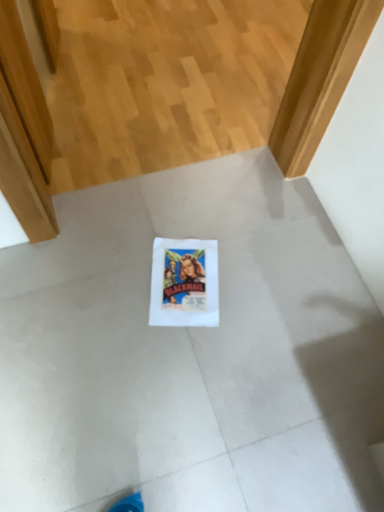
Where is `vacant space in white paper flyer at center (from a real-world perspective)`? vacant space in white paper flyer at center (from a real-world perspective) is located at coordinates (185, 278).